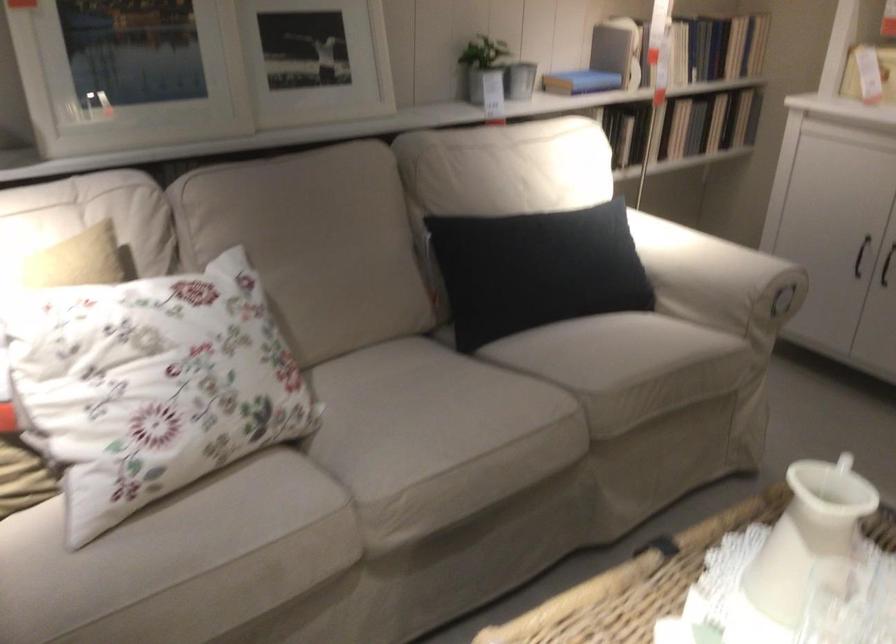
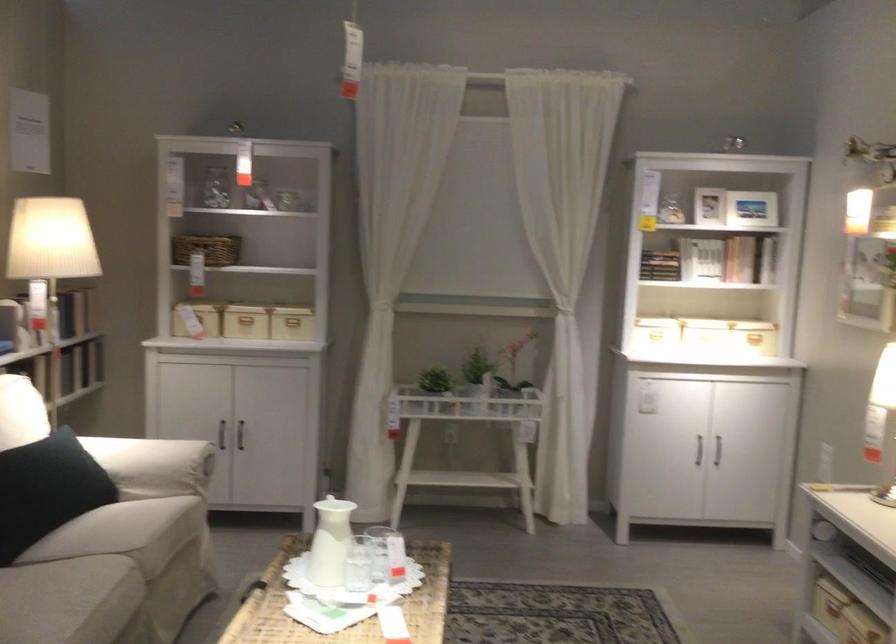
In the second image, find the point that corresponds to (x=784, y=529) in the first image.

(330, 542)